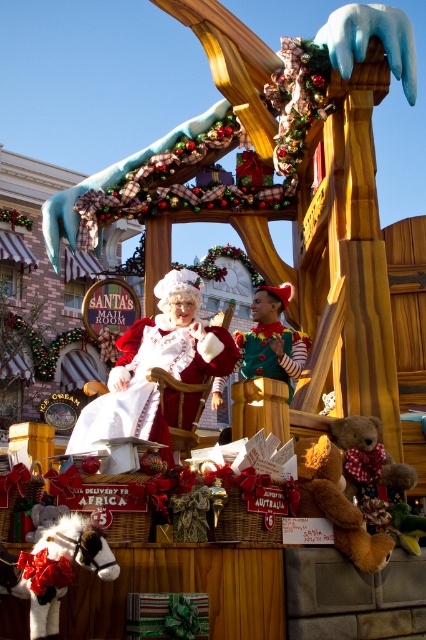
Question: Among these objects, which one is farthest from the camera?

Choices:
 (A) white plush horse at lower left
 (B) soft brown teddy bear at lower right

Answer: (B)

Question: Is white satin santa claus at center to the right of fluffy brown teddy bear at center from the viewer's perspective?

Choices:
 (A) yes
 (B) no

Answer: (B)

Question: Does white plush horse at lower left have a smaller size compared to green felt elf at center?

Choices:
 (A) no
 (B) yes

Answer: (B)

Question: Which point is closer to the camera?

Choices:
 (A) white plush horse at lower left
 (B) fluffy brown teddy bear at center
 (C) green felt elf at center

Answer: (A)

Question: Which point is closer to the camera?

Choices:
 (A) (363, 481)
 (B) (238, 337)
 (C) (54, 620)
 (D) (180, 317)

Answer: (C)

Question: Does white satin santa claus at center have a smaller size compared to green felt elf at center?

Choices:
 (A) no
 (B) yes

Answer: (A)